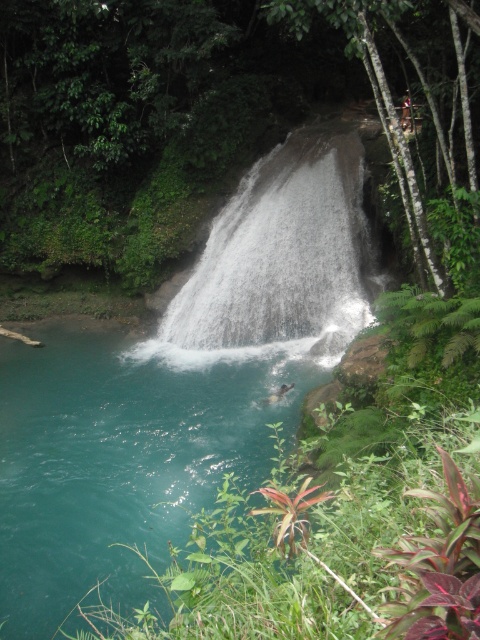
Question: Can you confirm if teal glossy water at center is positioned to the left of white textured waterfall at center?

Choices:
 (A) yes
 (B) no

Answer: (A)

Question: Which of the following is the closest to the observer?

Choices:
 (A) (337, 129)
 (B) (178, 410)

Answer: (B)

Question: Does teal glossy water at center appear over white textured waterfall at center?

Choices:
 (A) yes
 (B) no

Answer: (B)

Question: Where is teal glossy water at center located in relation to white textured waterfall at center in the image?

Choices:
 (A) right
 (B) left

Answer: (B)